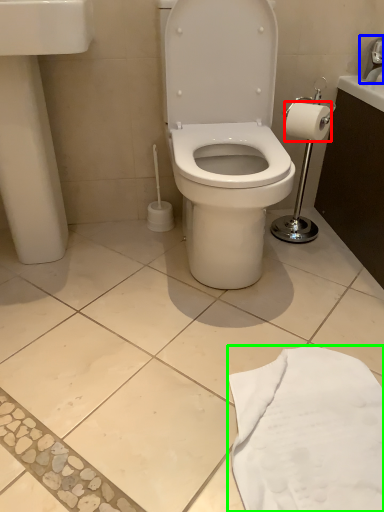
Question: Which object is positioned farthest from toilet paper (highlighted by a red box)? Select from faucet (highlighted by a blue box) and cloth (highlighted by a green box).

Choices:
 (A) faucet
 (B) cloth

Answer: (B)